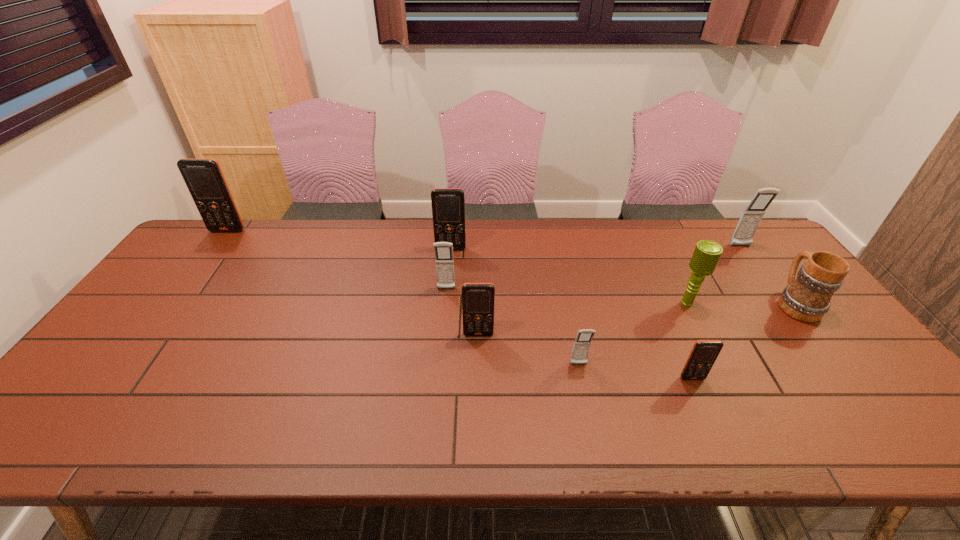
The image size is (960, 540). In order to click on the tallest cellular telephone in this screenshot , I will do `click(204, 179)`.

Where is `the leftmost orange cellular telephone`? The image size is (960, 540). the leftmost orange cellular telephone is located at coordinates (204, 179).

Where is `the rightmost cellular telephone`? The image size is (960, 540). the rightmost cellular telephone is located at coordinates (743, 235).

Where is `the biggest gray cellular telephone`? The image size is (960, 540). the biggest gray cellular telephone is located at coordinates (743, 235).

Locate an element on the screen. The width and height of the screenshot is (960, 540). the second biggest orange cellular telephone is located at coordinates (448, 204).

Identify the location of the third orange cellular telephone from right to left. (448, 204).

Identify the location of microphone. This screenshot has height=540, width=960. (706, 255).

Identify the location of the leftmost gray cellular telephone. The image size is (960, 540). (444, 259).

Where is `the second smallest gray cellular telephone`? This screenshot has width=960, height=540. the second smallest gray cellular telephone is located at coordinates (444, 259).

Locate an element on the screen. The image size is (960, 540). the sixth object from right to left is located at coordinates (478, 299).